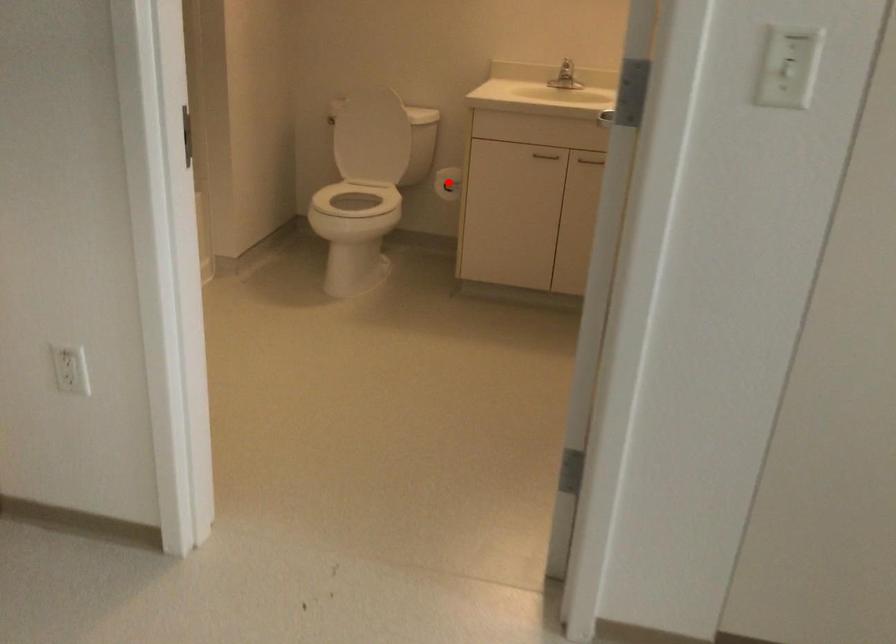
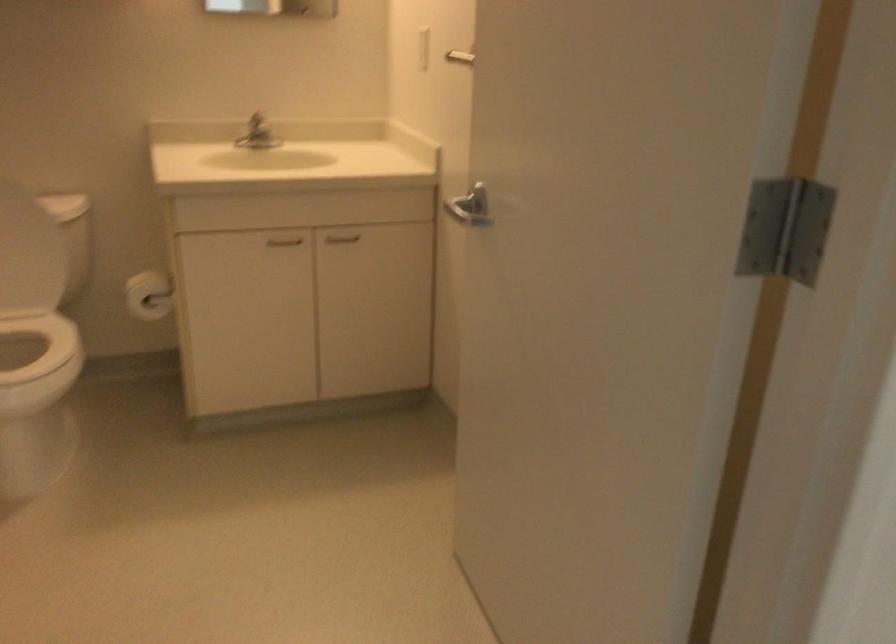
Question: I am providing you with two images of the same scene from different viewpoints. In image1, a red point is highlighted. Considering the same 3D point in image2, which of the following is correct?

Choices:
 (A) It is closer
 (B) It is farther

Answer: (A)